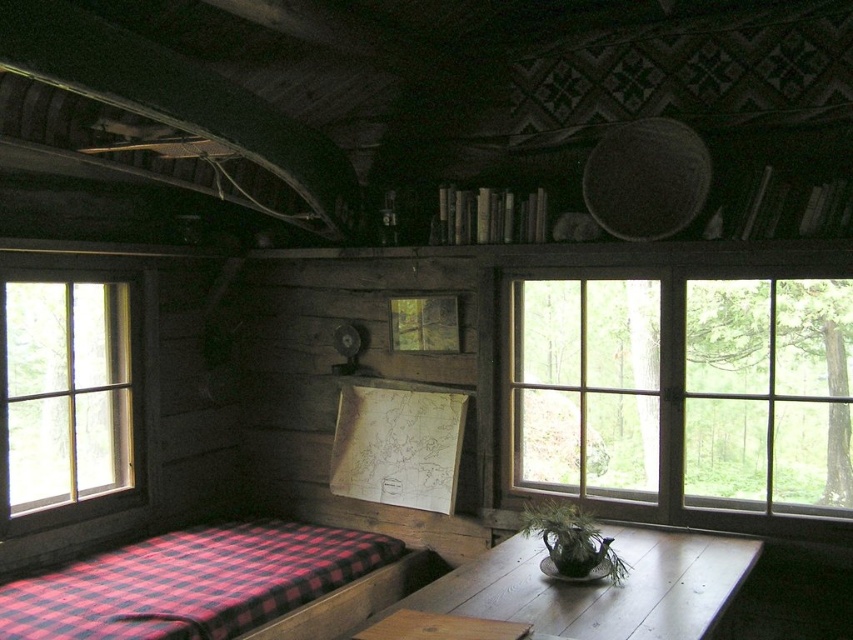
You are standing in the rustic cabin and want to let more sunlight into the room. Which window, the clear glass window at right or the clear glass window at left, should you open wider to achieve this?

The clear glass window at right might be wider than clear glass window at left, so opening the clear glass window at right wider could allow more sunlight into the room.

You are a painter who needs to set up an easel between the clear glass window at right and the clear glass window at left in the cabin. The easel requires a minimum of 6 feet of space to be placed safely. Based on the scene, can you fit the easel between them?

The clear glass window at right and clear glass window at left are 6.67 feet apart from each other, so yes, the easel can be placed between them as the distance is sufficient to accommodate the required 6 feet space.

Consider the image. You are standing in the rustic cabin and want to place a new painting on the wall above the red checkered blanket at lower left. Is there enough space between the blanket and the clear glass window at left to hang it?

The red checkered blanket at lower left is located below the clear glass window at left, so there is space between them. The painting can be hung on the wall above the red checkered blanket at lower left and below the clear glass window at left.